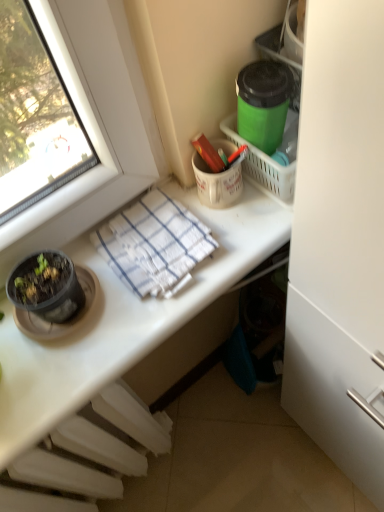
Question: From the image's perspective, relative to white glossy desk at upper center, is white woven towel at center above or below?

Choices:
 (A) above
 (B) below

Answer: (A)

Question: Is white woven towel at center situated inside white glossy desk at upper center or outside?

Choices:
 (A) inside
 (B) outside

Answer: (B)

Question: Considering the real-world distances, which object is farthest from the white woven towel at center?

Choices:
 (A) white glossy desk at upper center
 (B) green matte container at upper right
 (C) white plastic radiator at lower left

Answer: (C)

Question: Which object is the farthest from the white glossy desk at upper center?

Choices:
 (A) green matte container at upper right
 (B) white plastic radiator at lower left
 (C) white woven towel at center

Answer: (A)